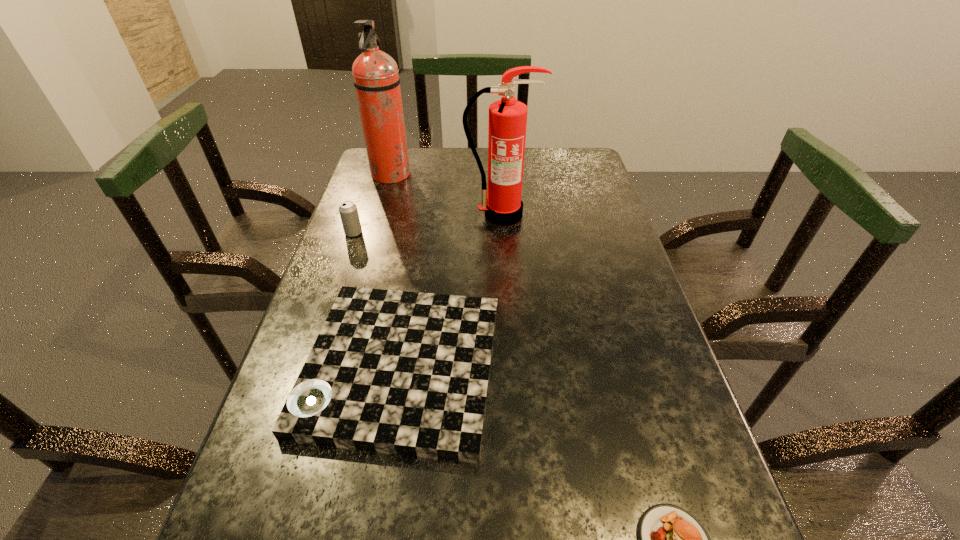
You are a GUI agent. You are given a task and a screenshot of the screen. Output one action in this format:
    pyautogui.click(x=<x>, y=<y>)
    Task: Click on the free space between the second farthest object and the farther fire extinguisher
    The width and height of the screenshot is (960, 540).
    Given the screenshot: What is the action you would take?
    pyautogui.click(x=445, y=195)

This screenshot has width=960, height=540. What are the coordinates of `vacant area that lies between the checkerboard and the nearer fire extinguisher` in the screenshot? It's located at (451, 291).

Where is `free area in between the left fire extinguisher and the third tallest object`? free area in between the left fire extinguisher and the third tallest object is located at coordinates (372, 204).

Where is `object that stands as the third closest to the checkerboard`? This screenshot has height=540, width=960. object that stands as the third closest to the checkerboard is located at coordinates (507, 117).

Select which object is the closest to the third nearest object. Please provide its 2D coordinates. Your answer should be formatted as a tuple, i.e. [(x, y)], where the tuple contains the x and y coordinates of a point satisfying the conditions above.

[(376, 78)]

Image resolution: width=960 pixels, height=540 pixels. In order to click on vacant region that satisfies the following two spatial constraints: 1. at the nozzle of the second nearest object; 2. on the left side of the left fire extinguisher in this screenshot , I will do `click(335, 367)`.